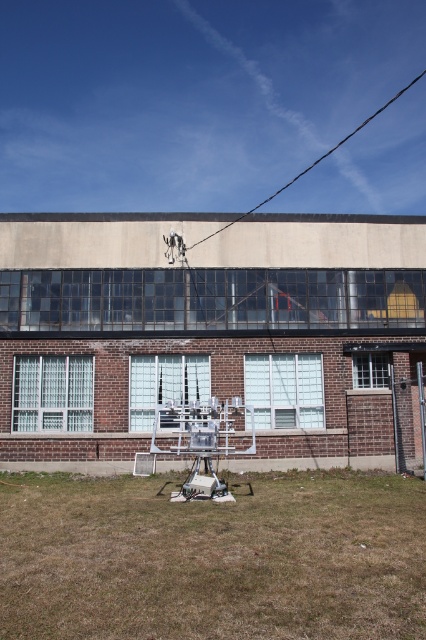
Question: Does brown dry grass at lower center appear under black wire at upper center?

Choices:
 (A) no
 (B) yes

Answer: (B)

Question: Among these points, which one is nearest to the camera?

Choices:
 (A) coord(259,205)
 (B) coord(81,506)

Answer: (B)

Question: Which object appears closest to the camera in this image?

Choices:
 (A) brown dry grass at lower center
 (B) black wire at upper center

Answer: (A)

Question: Can you confirm if brown dry grass at lower center is smaller than black wire at upper center?

Choices:
 (A) no
 (B) yes

Answer: (B)

Question: Is brown dry grass at lower center below black wire at upper center?

Choices:
 (A) no
 (B) yes

Answer: (B)